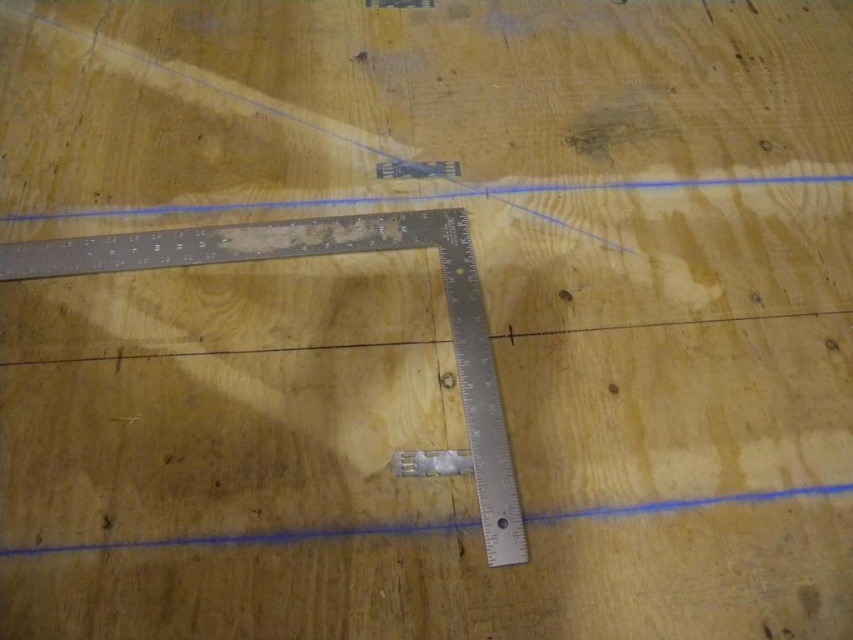
Question: Which point is closer to the camera?

Choices:
 (A) (67, 548)
 (B) (222, 250)
 (C) (746, 180)

Answer: (A)

Question: Considering the real-world distances, which object is closest to the blue line at upper center?

Choices:
 (A) silver metallic ruler at center
 (B) metallic ruler at bottom

Answer: (A)

Question: Can you confirm if silver metallic ruler at center is smaller than blue line at upper center?

Choices:
 (A) yes
 (B) no

Answer: (B)

Question: Does silver metallic ruler at center appear under blue line at upper center?

Choices:
 (A) no
 (B) yes

Answer: (B)

Question: Does metallic ruler at bottom appear under blue line at upper center?

Choices:
 (A) no
 (B) yes

Answer: (B)

Question: Which point is farther to the camera?

Choices:
 (A) metallic ruler at bottom
 (B) blue line at upper center

Answer: (B)